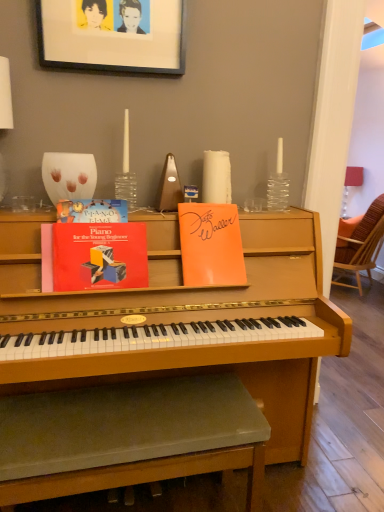
Question: Would you say wooden woven chair at right is a long distance from orange paper at upper center, the 3th paperback book when ordered from left to right?

Choices:
 (A) no
 (B) yes

Answer: (B)

Question: From a real-world perspective, is wooden woven chair at right positioned under orange paper at upper center, the first paperback book when ordered from right to left, based on gravity?

Choices:
 (A) yes
 (B) no

Answer: (A)

Question: Is wooden woven chair at right further to the viewer compared to orange paper at upper center, the first paperback book when ordered from right to left?

Choices:
 (A) no
 (B) yes

Answer: (B)

Question: Could orange paper at upper center, the 3th paperback book when ordered from left to right, be considered to be inside wooden woven chair at right?

Choices:
 (A) yes
 (B) no

Answer: (B)

Question: Is wooden woven chair at right smaller than orange paper at upper center, the 3th paperback book when ordered from left to right?

Choices:
 (A) yes
 (B) no

Answer: (B)

Question: Is wooden woven chair at right aimed at orange paper at upper center, the first paperback book when ordered from right to left?

Choices:
 (A) no
 (B) yes

Answer: (A)

Question: Are hardcover book at upper left, which is counted as the third paperback book, starting from the right, and matte red book at center, arranged as the 2th paperback book when viewed from the right, located far from each other?

Choices:
 (A) no
 (B) yes

Answer: (A)

Question: From a real-world perspective, is hardcover book at upper left, acting as the 1th paperback book starting from the left, located beneath matte red book at center, arranged as the 2th paperback book when viewed from the right?

Choices:
 (A) no
 (B) yes

Answer: (A)

Question: Does hardcover book at upper left, acting as the 1th paperback book starting from the left, have a larger size compared to matte red book at center, the 2th paperback book from the left?

Choices:
 (A) no
 (B) yes

Answer: (A)

Question: Is hardcover book at upper left, which is counted as the third paperback book, starting from the right, at the left side of matte red book at center, the 2th paperback book from the left?

Choices:
 (A) yes
 (B) no

Answer: (A)

Question: Can you confirm if hardcover book at upper left, which is counted as the third paperback book, starting from the right, is wider than matte red book at center, the 2th paperback book from the left?

Choices:
 (A) yes
 (B) no

Answer: (B)

Question: Is hardcover book at upper left, acting as the 1th paperback book starting from the left, facing towards matte red book at center, the 2th paperback book from the left?

Choices:
 (A) yes
 (B) no

Answer: (B)

Question: Is the position of hardcover book at upper left, acting as the 1th paperback book starting from the left, more distant than that of black matte picture frame at upper center?

Choices:
 (A) yes
 (B) no

Answer: (B)